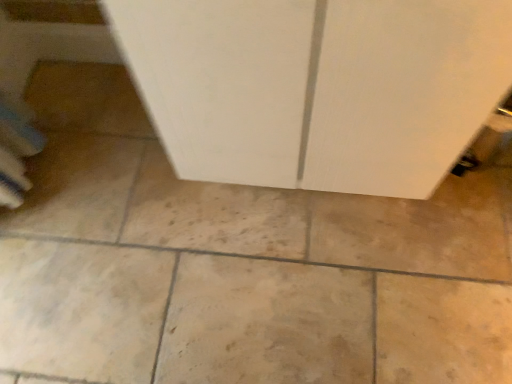
The width and height of the screenshot is (512, 384). Identify the location of vacant region to the left of white matte cabinet at center. (121, 203).